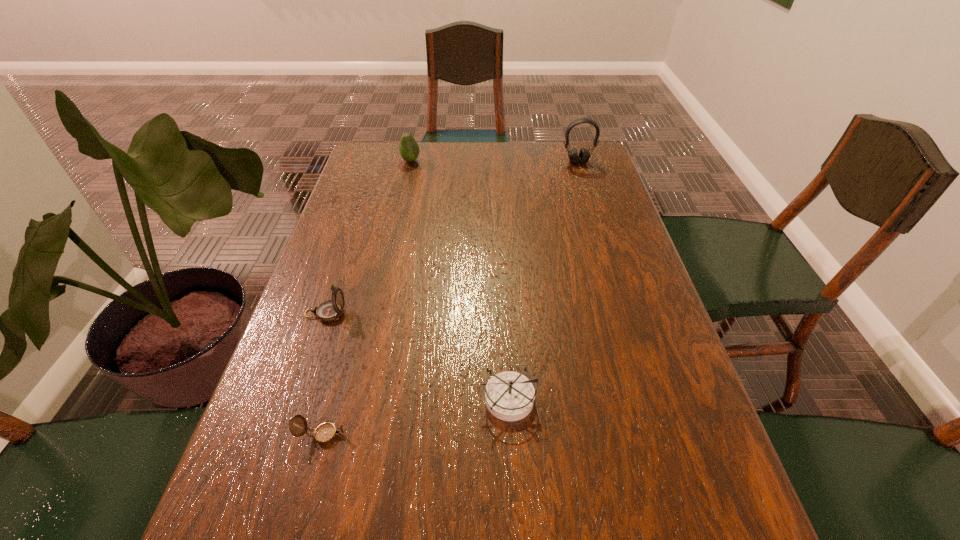
Identify the location of free spot located on the right of the avocado. The image size is (960, 540). (482, 161).

At what (x,y) coordinates should I click in order to perform the action: click on vacant space situated on the face of the third farthest object. Please return your answer as a coordinate pair (x, y). Looking at the image, I should click on (491, 313).

Locate an element on the screen. This screenshot has height=540, width=960. vacant space located on the right of the rightmost compass is located at coordinates (592, 399).

This screenshot has height=540, width=960. I want to click on free location located on the face of the nearest compass, so click(x=545, y=435).

Where is `headset at the far edge`? Image resolution: width=960 pixels, height=540 pixels. headset at the far edge is located at coordinates (584, 154).

You are a GUI agent. You are given a task and a screenshot of the screen. Output one action in this format:
    pyautogui.click(x=<x>, y=<y>)
    Task: Click on the avocado present at the far edge
    Image resolution: width=960 pixels, height=540 pixels.
    Given the screenshot: What is the action you would take?
    pyautogui.click(x=409, y=150)

Identify the location of avocado that is positioned at the left edge. This screenshot has height=540, width=960. (409, 150).

The width and height of the screenshot is (960, 540). Find the location of `object that is at the right edge`. object that is at the right edge is located at coordinates (584, 154).

Where is `object at the far left corner`? The width and height of the screenshot is (960, 540). object at the far left corner is located at coordinates (409, 150).

Identify the location of object situated at the far right corner. This screenshot has height=540, width=960. (584, 154).